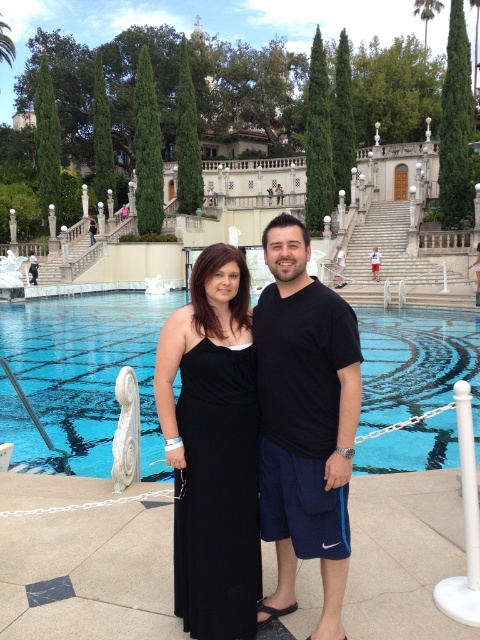
You are standing in the foreground of the scene, near the two people. You want to walk towards the pool but need to avoid stepping on any obstacles. There are two points marked in the image, point A at coordinates point A is point (49, 314) and point B is point (256, 518). Which point should you avoid stepping on to stay closer to the pool?

You should avoid stepping on point B at coordinates point (256, 518) because point A at coordinates point (49, 314) is closer to the viewer, meaning point B is further away and closer to the pool area.